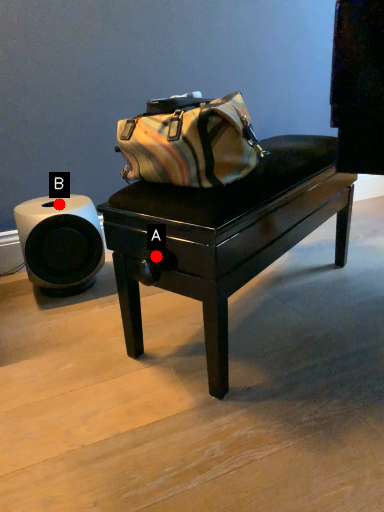
Question: Two points are circled on the image, labeled by A and B beside each circle. Which point is closer to the camera taking this photo?

Choices:
 (A) A is closer
 (B) B is closer

Answer: (A)